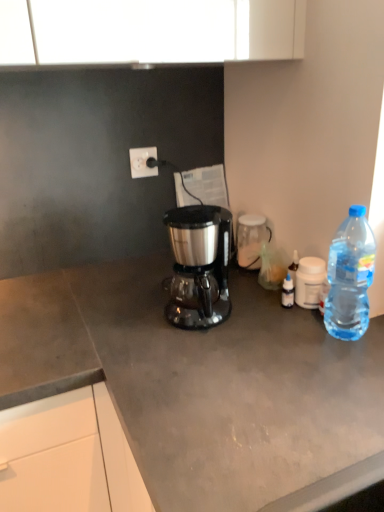
Image resolution: width=384 pixels, height=512 pixels. In order to click on vacant space to the right of satin black coffee maker at center in this screenshot , I will do `click(252, 309)`.